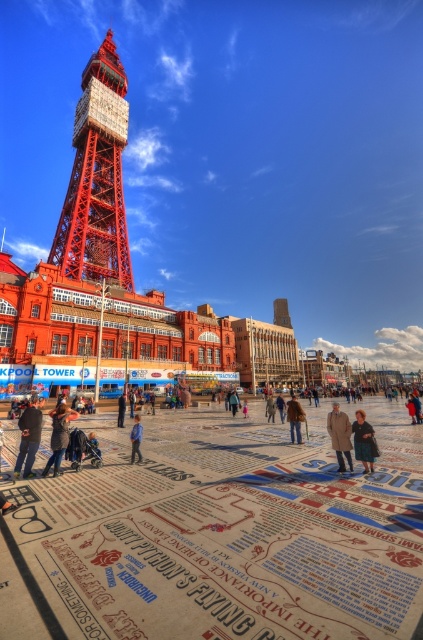
Which is above, beige mosaic tiles at center or dark blue fabric coat at center?

dark blue fabric coat at center

I want to click on beige mosaic tiles at center, so click(x=219, y=534).

Find the location of a particular element. The height and width of the screenshot is (640, 423). beige mosaic tiles at center is located at coordinates (219, 534).

This screenshot has width=423, height=640. Describe the element at coordinates (219, 534) in the screenshot. I see `beige mosaic tiles at center` at that location.

Where is `beige mosaic tiles at center`? Image resolution: width=423 pixels, height=640 pixels. beige mosaic tiles at center is located at coordinates (219, 534).

Locate an element on the screen. Image resolution: width=423 pixels, height=640 pixels. beige mosaic tiles at center is located at coordinates (219, 534).

Between point (331, 428) and point (242, 408), which one is positioned in front?

Point (331, 428)

Does light brown leather coat at center appear on the left side of light blue denim jacket at center?

Incorrect, light brown leather coat at center is not on the left side of light blue denim jacket at center.

Which is behind, point (340, 464) or point (244, 406)?

The point (244, 406) is more distant.

At what (x,y) coordinates should I click in order to perform the action: click on light brown leather coat at center. Please return your answer as a coordinate pair (x, y). Looking at the image, I should click on (340, 435).